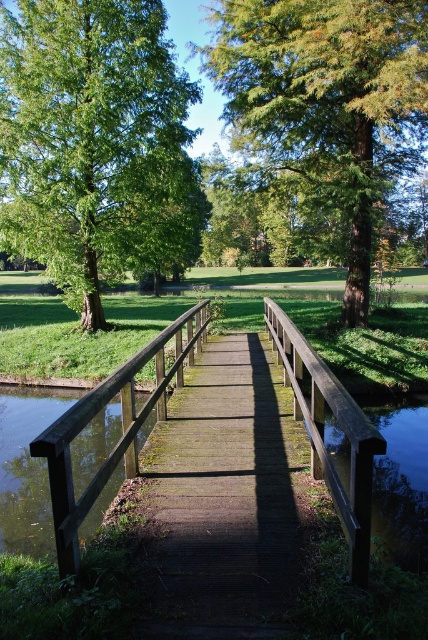
You are standing on the wooden bridge in the park and notice two points marked in the scene. The first point is at coordinates point (388, 28) and the second is at point (318, 385). Which of these two points is closer to your current position on the bridge?

Point (318, 385) is closer to your current position on the bridge because it is less further to the camera than point (388, 28).

You are standing on the wooden bridge in the park scene and notice a point marked at coordinates [86,129]. Which object in the scene does this point correspond to?

The point at coordinates [86,129] corresponds to the green matte tree at upper left.